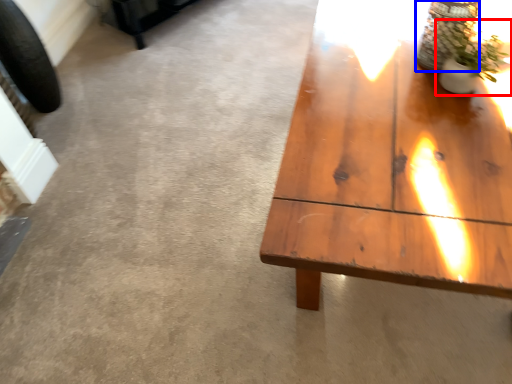
Question: Among these objects, which one is farthest to the camera, houseplant (highlighted by a red box) or glass vase (highlighted by a blue box)?

Choices:
 (A) houseplant
 (B) glass vase

Answer: (B)